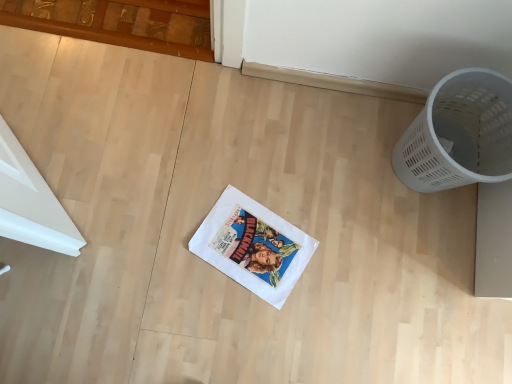
What are the coordinates of `vacant area situated to the left side of white paper comic book at center` in the screenshot? It's located at (170, 223).